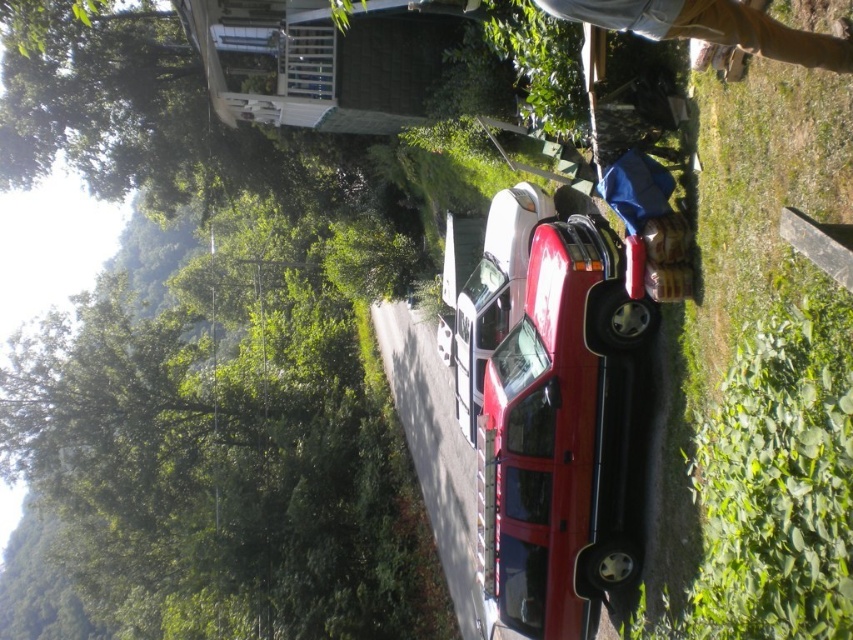
You are a delivery person trying to park a 6.2 meter long truck in this driveway. The glossy red car at center and the tan denim pants at upper right are in the way. Can you fit your truck between them?

The glossy red car at center is 5.81 meters from the tan denim pants at upper right. Since your truck is 6.2 meters long, it is slightly longer than the available space between them. Therefore, you cannot fit your truck between the glossy red car at center and the tan denim pants at upper right.

You are a delivery person trying to park your van in the driveway shown in the image. You see the glossy red car at center and the tan denim pants at upper right. Which object takes up more space in the driveway?

The glossy red car at center takes up more space in the driveway because it is bigger than the tan denim pants at upper right.

You are a pedestrian standing near the glossy red car at center and want to reach the tan denim pants at upper right. Is there a clear path between them without crossing the driveway?

The tan denim pants at upper right is behind the glossy red car at center, so there is a clear path between them as long as you go around the car.